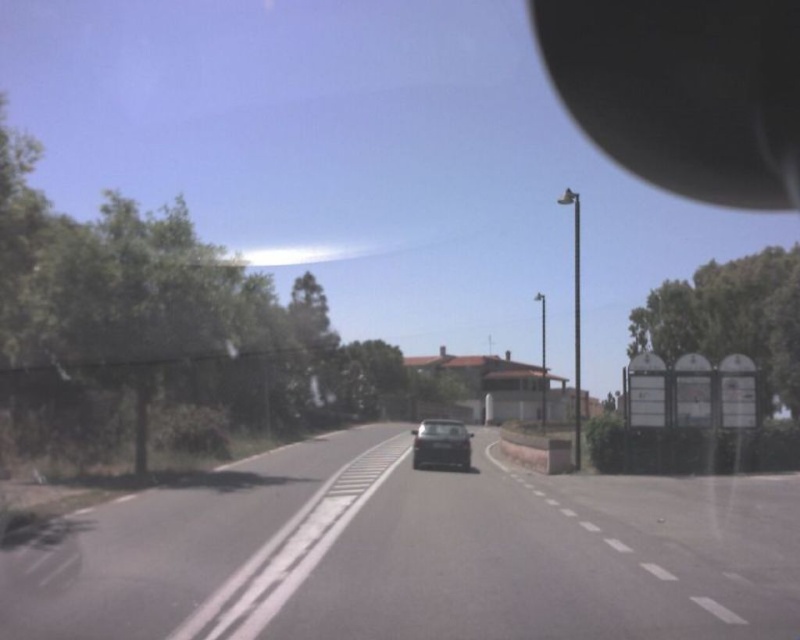
You are driving a car that is 4.5 meters long. You see the black asphalt road at center and the satin black car at center ahead. Can your car fit in the space between them?

The space between the black asphalt road at center and the satin black car at center is 9.39 meters. Since your car is 4.5 meters long, there is enough space to fit your car in that gap.

You are driving a satin black car at center and want to stay in your lane. Based on the scene, which side of the road is the black asphalt road at center located relative to your vehicle?

The black asphalt road at center is positioned on the left side of the satin black car at center, so the road is on the left side of your vehicle.

You are driving a car and want to know if you can safely pass another vehicle ahead. The black rubber view mirror at upper right is attached to the vehicle in front of you, and the satin black car at center is your car. Can you safely pass the vehicle ahead within the next 40 meters?

The distance between the black rubber view mirror at upper right and the satin black car at center is 39.34 meters, which is just under 40 meters. Therefore, you can safely pass the vehicle ahead within the next 40 meters.